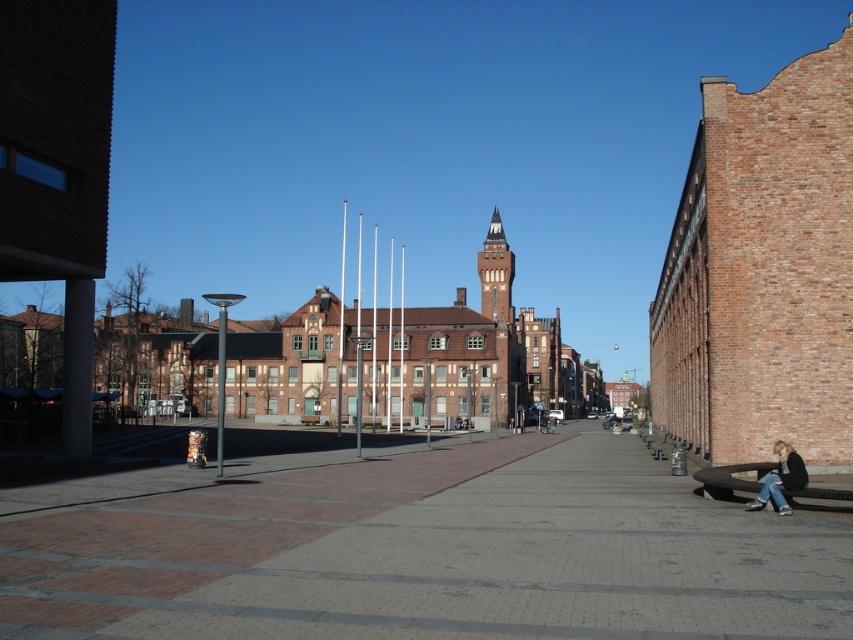
You are standing at the edge of the plaza and notice both the brick pavement at center and the denim jeans at lower right. Which object is positioned to the left of the other?

The brick pavement at center is to the left of denim jeans at lower right.

Looking at this image, you are a photographer standing in the plaza and want to capture both the brick pavement at center and the denim jeans at lower right in a single frame. Given their height difference, which object will appear larger in the photo?

The brick pavement at center will appear larger in the photo because it is much taller than the denim jeans at lower right, making it dominate the frame.